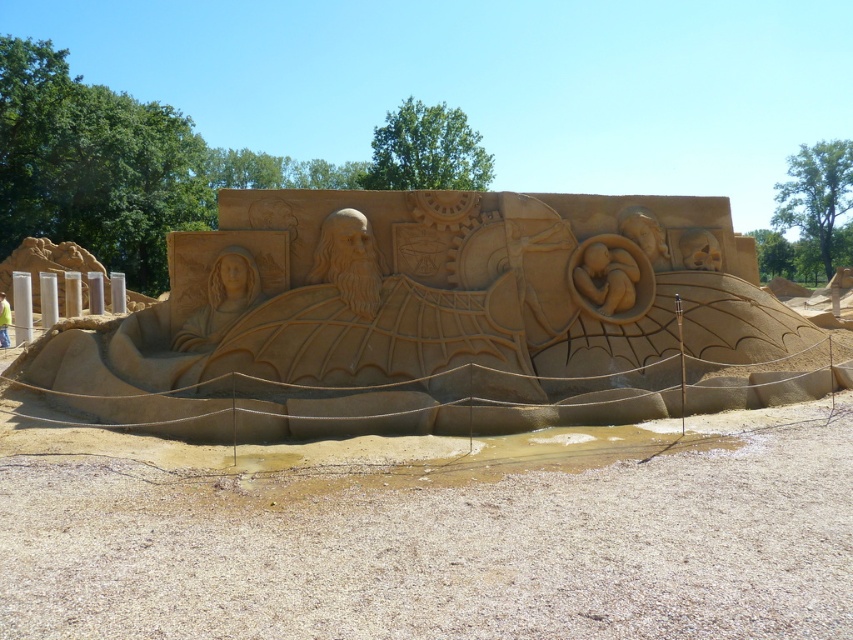
You are standing in front of the sand sculpture and want to touch the sandy sculpture at center and the matte sand sculpture at center. Which one can you reach first without moving your hand?

The sandy sculpture at center is closer to the viewer than the matte sand sculpture at center, so you can reach the sandy sculpture at center first.